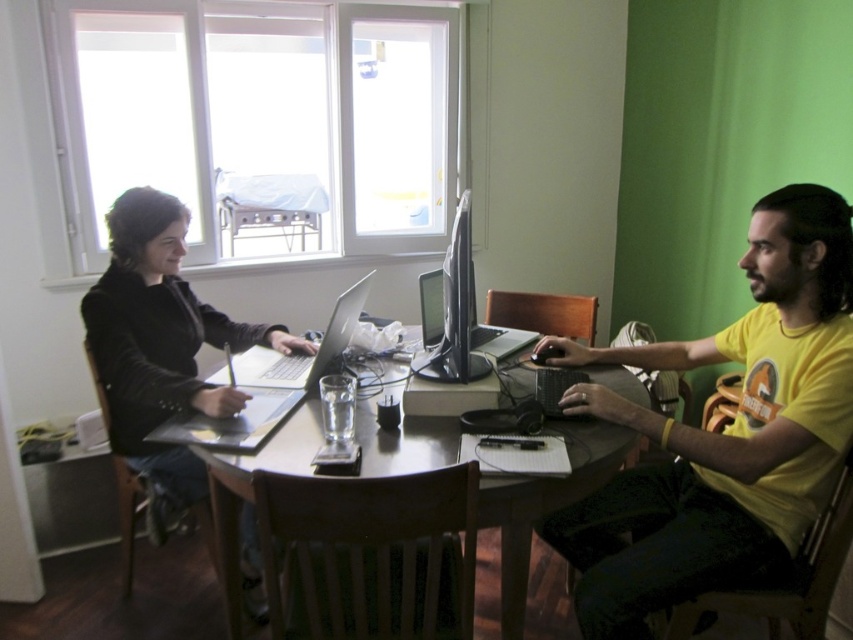
Question: Which of the following is the closest to the observer?

Choices:
 (A) (515, 570)
 (B) (737, 492)
 (C) (488, 364)
 (D) (344, 294)

Answer: (A)

Question: Which point appears closest to the camera in this image?

Choices:
 (A) (221, 504)
 (B) (189, 310)
 (C) (630, 417)
 (D) (283, 371)

Answer: (C)

Question: Estimate the real-world distances between objects in this image. Which object is closer to the matte black monitor at center?

Choices:
 (A) yellow cotton t-shirt at right
 (B) silver metallic laptop at center
 (C) wooden table at center
 (D) matte black laptop at left

Answer: (C)

Question: Is matte black monitor at center positioned at the back of silver metallic laptop at center?

Choices:
 (A) yes
 (B) no

Answer: (B)

Question: Is yellow cotton t-shirt at right wider than wooden table at center?

Choices:
 (A) no
 (B) yes

Answer: (A)

Question: Does matte black laptop at left lie behind matte black monitor at center?

Choices:
 (A) no
 (B) yes

Answer: (B)